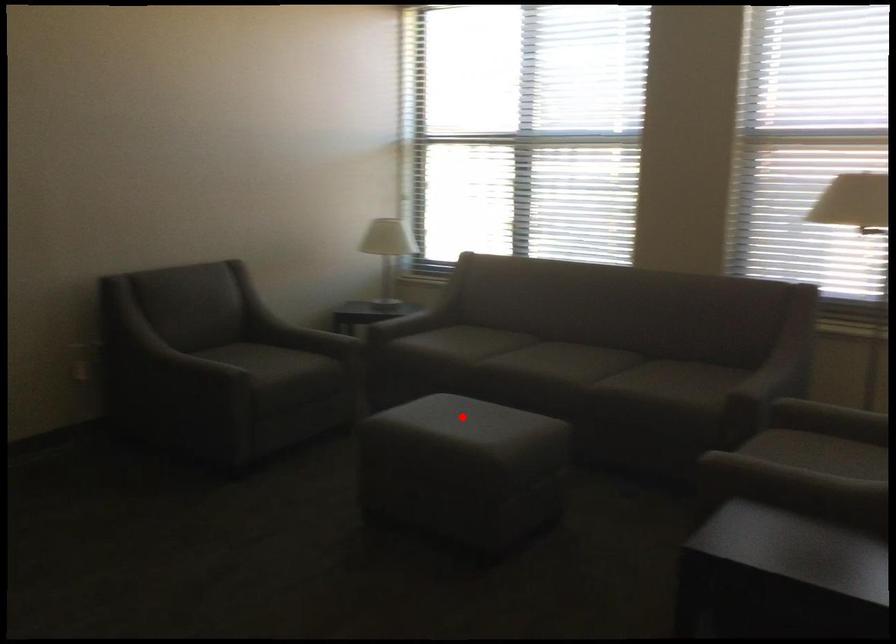
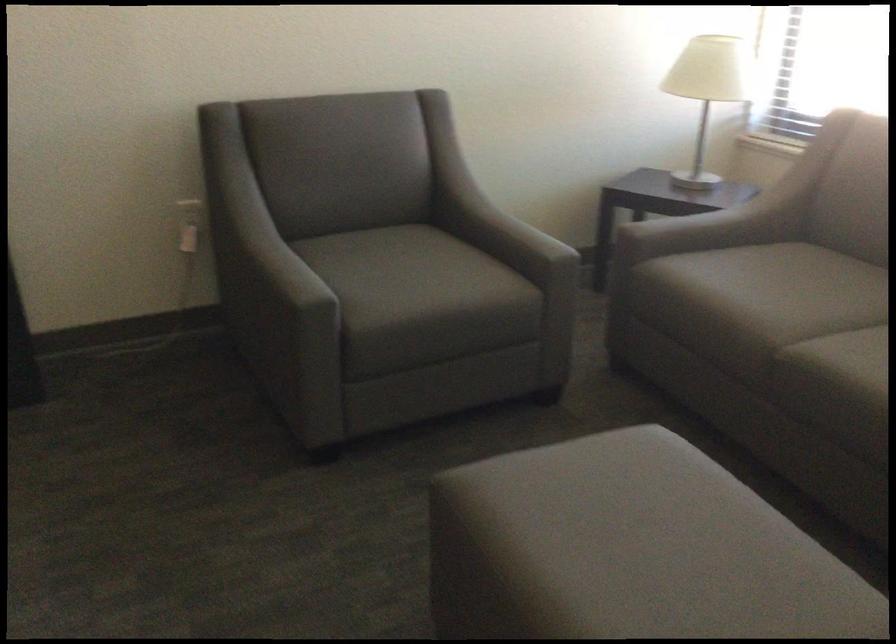
Where in the second image is the point corresponding to the highlighted location from the first image?

(633, 542)